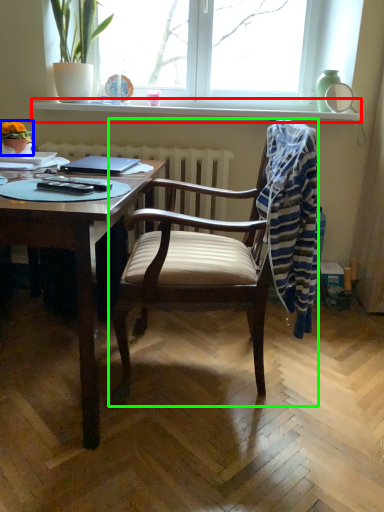
Question: Which object is positioned farthest from window sill (highlighted by a red box)? Select from houseplant (highlighted by a blue box) and chair (highlighted by a green box).

Choices:
 (A) houseplant
 (B) chair

Answer: (B)